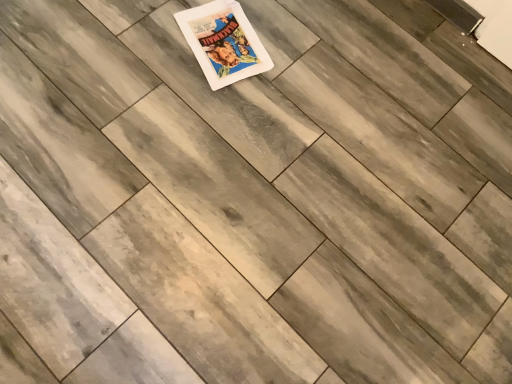
Where is `free spot to the right of matte white comic book at upper center`? The height and width of the screenshot is (384, 512). free spot to the right of matte white comic book at upper center is located at coordinates (305, 62).